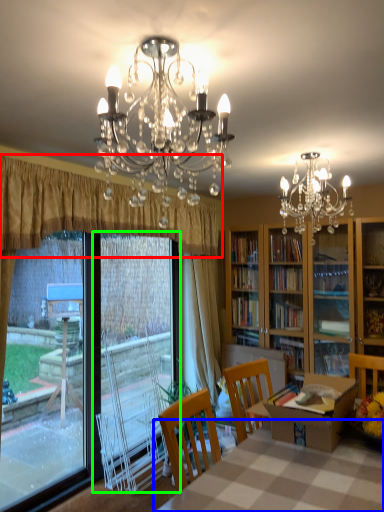
Question: Estimate the real-world distances between objects in this image. Which object is closer to curtain (highlighted by a red box), table (highlighted by a blue box) or screen door (highlighted by a green box)?

Choices:
 (A) table
 (B) screen door

Answer: (B)